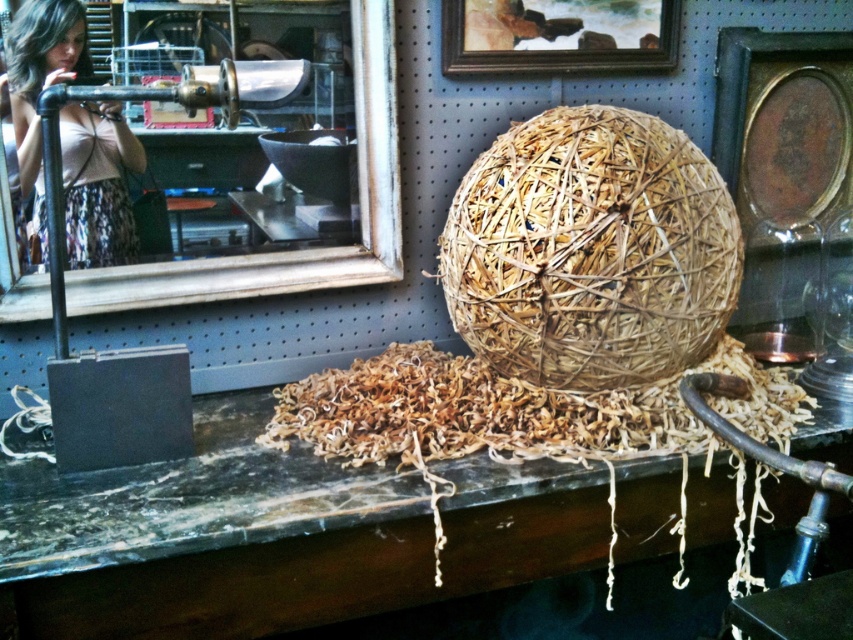
Question: Is natural straw ball at center bigger than matte black hair at upper left?

Choices:
 (A) no
 (B) yes

Answer: (B)

Question: Which object is positioned closest to the wooden mirror at upper left?

Choices:
 (A) matte black hair at upper left
 (B) natural straw ball at center

Answer: (A)

Question: Among these points, which one is farthest from the camera?

Choices:
 (A) (624, 246)
 (B) (21, 60)
 (C) (68, 536)

Answer: (B)

Question: From the image, what is the correct spatial relationship of brown marble table at center in relation to wooden mirror at upper left?

Choices:
 (A) left
 (B) right

Answer: (B)

Question: Can you confirm if natural straw ball at center is smaller than matte black hair at upper left?

Choices:
 (A) yes
 (B) no

Answer: (B)

Question: Which object is the closest to the natural straw ball at center?

Choices:
 (A) wooden frame at upper center
 (B) brown marble table at center
 (C) matte black hair at upper left

Answer: (B)